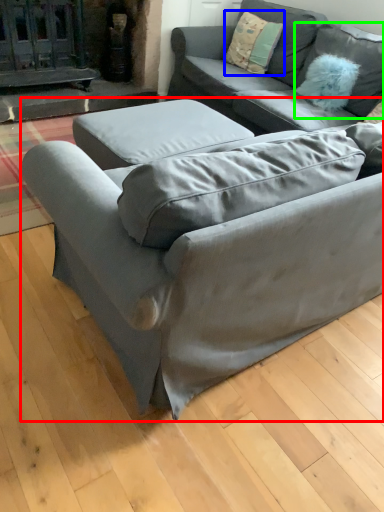
Question: Estimate the real-world distances between objects in this image. Which object is farther from studio couch (highlighted by a red box), pillow (highlighted by a blue box) or pillow (highlighted by a green box)?

Choices:
 (A) pillow
 (B) pillow

Answer: (A)